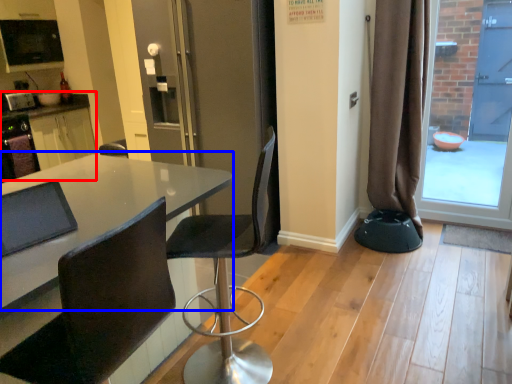
Question: Which object is further to the camera taking this photo, computer desk (highlighted by a red box) or table (highlighted by a blue box)?

Choices:
 (A) computer desk
 (B) table

Answer: (A)